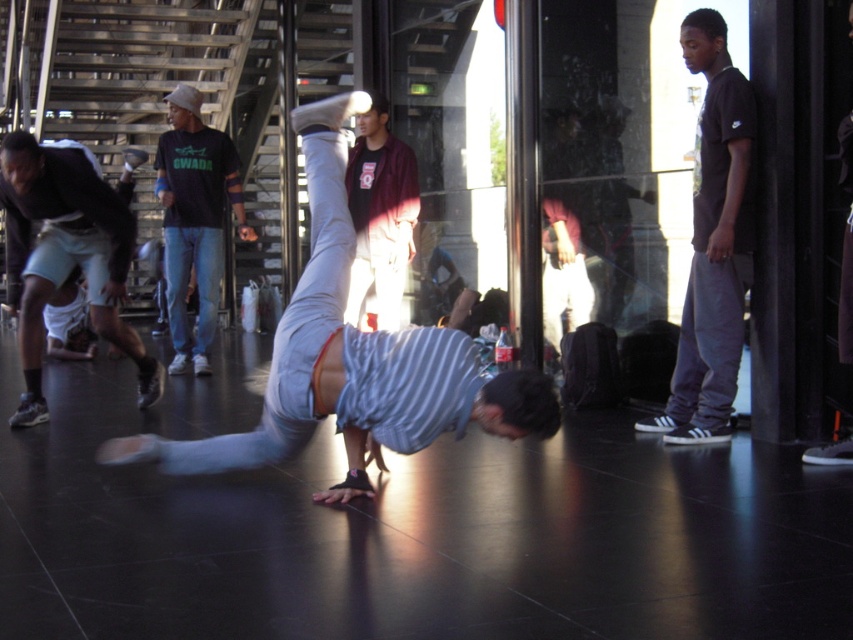
Question: Which of these objects is positioned farthest from the striped cotton shirt at center?

Choices:
 (A) maroon fabric pants at center
 (B) black matte shirt at right
 (C) light blue denim shorts at lower left
 (D) dark gray pants at right

Answer: (D)

Question: Can you confirm if striped cotton shirt at center is positioned to the right of dark gray pants at right?

Choices:
 (A) yes
 (B) no

Answer: (B)

Question: Can you confirm if black matte shirt at right is bigger than light blue denim shorts at lower left?

Choices:
 (A) yes
 (B) no

Answer: (B)

Question: Which of the following is the closest to the observer?

Choices:
 (A) black matte shirt at right
 (B) dark gray pants at right
 (C) maroon fabric pants at center
 (D) striped cotton shirt at center

Answer: (D)

Question: Which object is farther from the camera taking this photo?

Choices:
 (A) black matte shirt at right
 (B) dark gray pants at right

Answer: (A)

Question: Where is light blue denim shorts at lower left located in relation to maroon fabric pants at center in the image?

Choices:
 (A) right
 (B) left

Answer: (B)